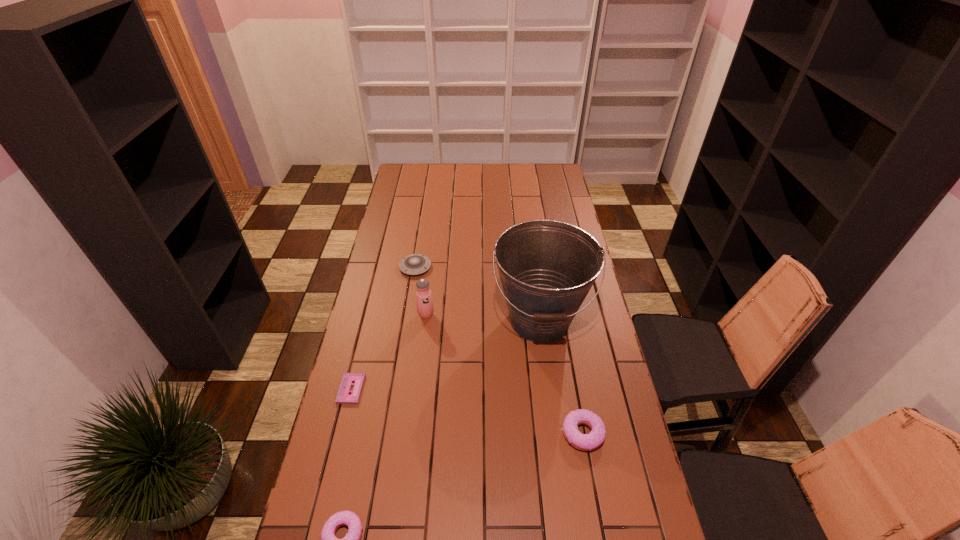
Locate an element on the screen. The width and height of the screenshot is (960, 540). free location located on the left of the thermos bottle is located at coordinates (389, 315).

The width and height of the screenshot is (960, 540). What are the coordinates of `blank space located on the front of the saucer` in the screenshot? It's located at (408, 310).

Locate an element on the screen. Image resolution: width=960 pixels, height=540 pixels. videotape located in the left edge section of the desktop is located at coordinates (343, 396).

Identify the location of saucer located at the left edge. (414, 264).

Locate an element on the screen. The height and width of the screenshot is (540, 960). doughnut at the right edge is located at coordinates (586, 442).

The width and height of the screenshot is (960, 540). Find the location of `bucket located at the right edge`. bucket located at the right edge is located at coordinates (546, 267).

This screenshot has width=960, height=540. In the image, there is a desktop. In order to click on vacant space at the far edge in this screenshot , I will do `click(466, 177)`.

Locate an element on the screen. blank area at the left edge is located at coordinates pyautogui.click(x=391, y=320).

Where is `free space at the right edge of the desktop`? Image resolution: width=960 pixels, height=540 pixels. free space at the right edge of the desktop is located at coordinates (563, 213).

Locate an element on the screen. This screenshot has width=960, height=540. free point at the far right corner is located at coordinates (536, 182).